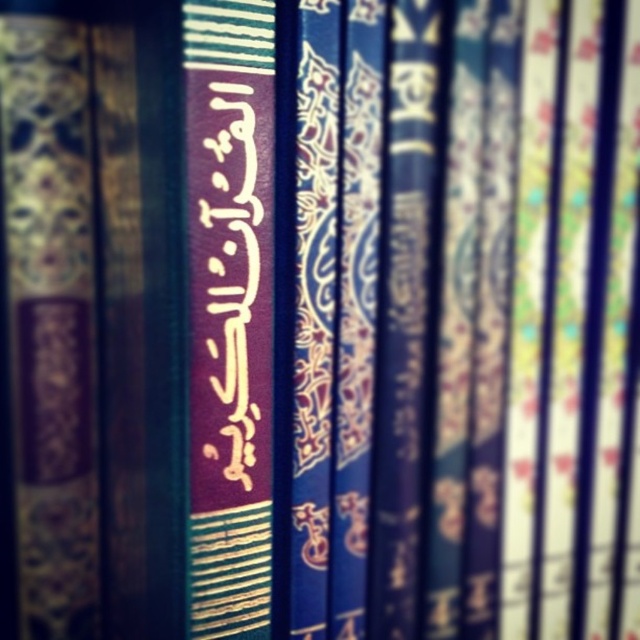
You are a librarian organizing books and notice two elements on the central spine of a book in the image. One is the matte gold text at center and the other is the dark purple paper at center. Which of these two elements is bigger in size?

The matte gold text at center has a larger size compared to the dark purple paper at center, so the matte gold text at center is bigger.

You are looking at the collection of books with their spines facing forward. There are two points marked on the image, one at point (209, 35) and the other at point (237, 276). Which point is closer to you?

Point (209, 35) is in front of point (237, 276), so the point at (209, 35) is closer to you.

You are a book conservator examining the central area of the book spines. You notice the matte gold text at center and the dark purple paper at center. Which object is closer to you?

The matte gold text at center is closer to you because it is in front of the dark purple paper at center.